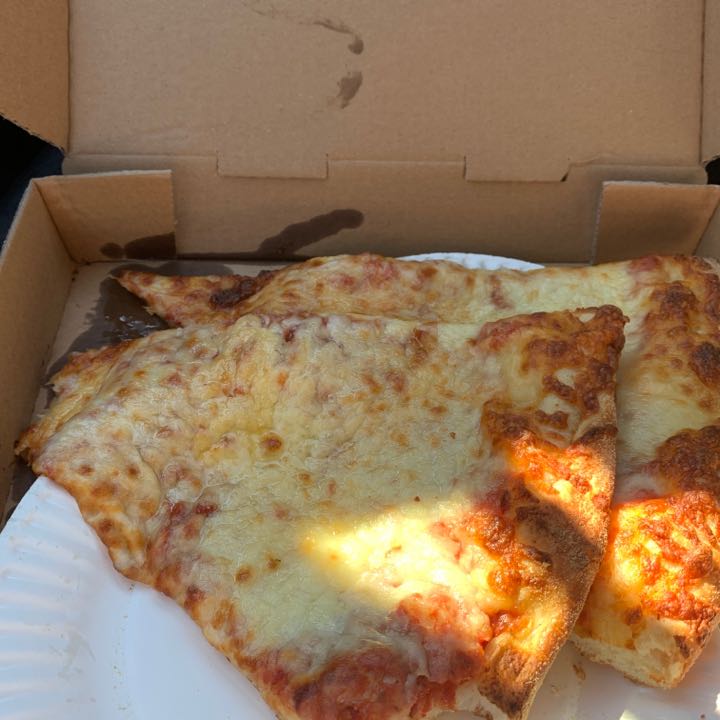
The width and height of the screenshot is (720, 720). Find the location of `paper plate`. paper plate is located at coordinates (147, 629).